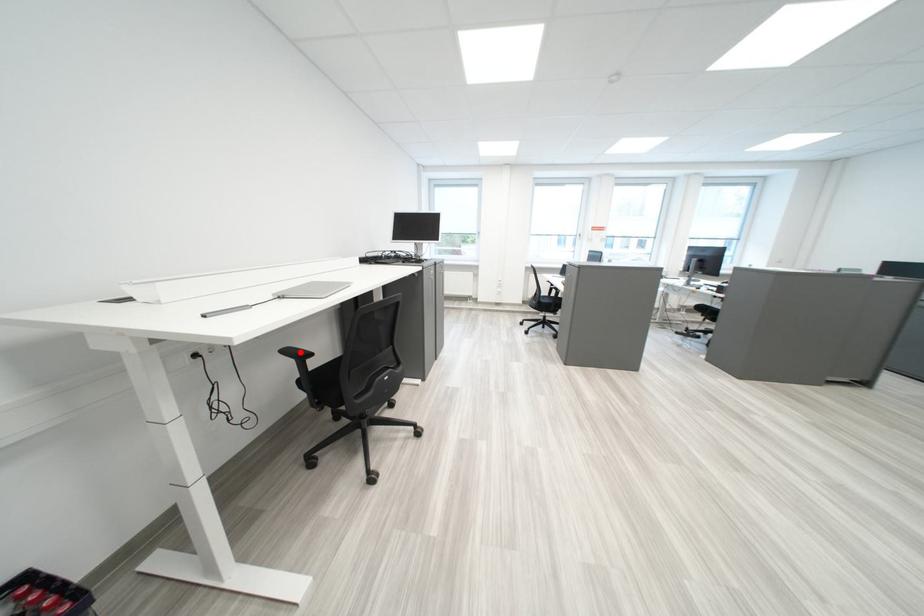
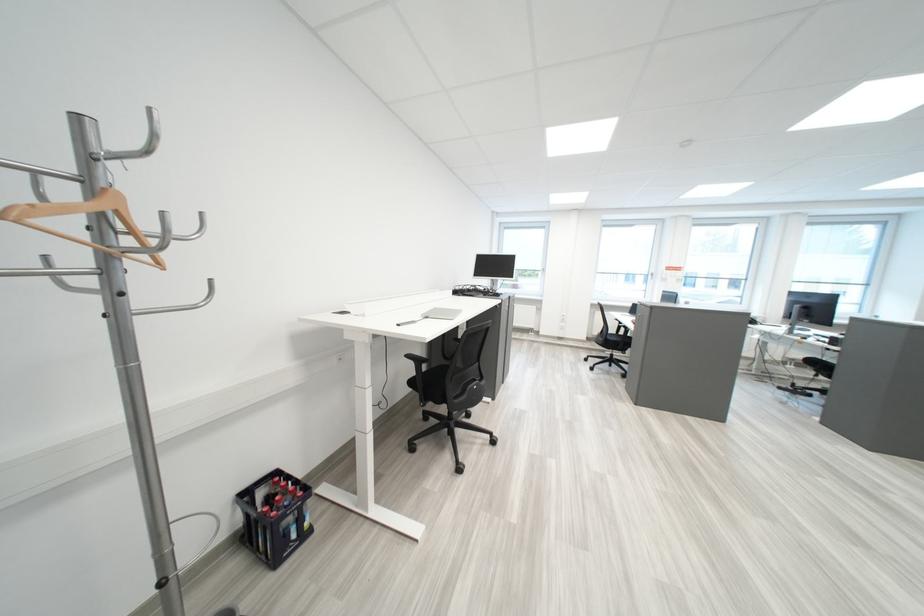
Question: I am providing you with two images of the same scene from different viewpoints. Image1 has a red point marked. In image2, the corresponding 3D location appears at what relative position? Reply with the corresponding letter.

Choices:
 (A) Closer
 (B) Farther

Answer: (B)